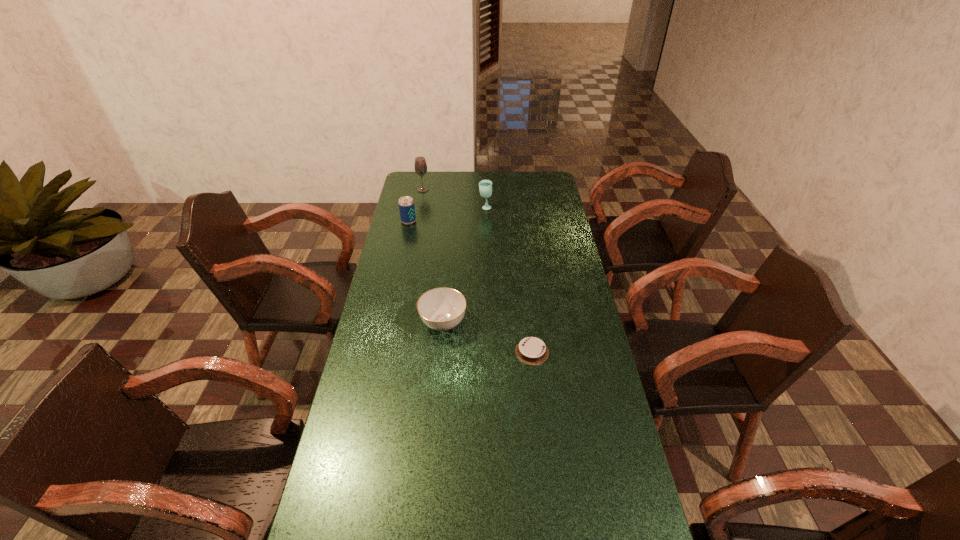
The height and width of the screenshot is (540, 960). Identify the location of free space at the right edge of the desktop. (560, 235).

Identify the location of free location at the far left corner. (413, 190).

Image resolution: width=960 pixels, height=540 pixels. I want to click on free space at the far right corner, so click(552, 177).

You are a GUI agent. You are given a task and a screenshot of the screen. Output one action in this format:
    pyautogui.click(x=<x>, y=<y>)
    Task: Click on the empty space between the chocolate cake and the third farthest object
    The width and height of the screenshot is (960, 540).
    Given the screenshot: What is the action you would take?
    pyautogui.click(x=470, y=287)

The width and height of the screenshot is (960, 540). Find the location of `vacant space in between the second shortest object and the right glass`. vacant space in between the second shortest object and the right glass is located at coordinates (465, 265).

Identify the location of vacant region between the chinaware and the beer can. pos(426,272).

Find the location of a particular element. The height and width of the screenshot is (540, 960). vacant region between the farthest object and the chinaware is located at coordinates (433, 256).

The width and height of the screenshot is (960, 540). What are the coordinates of `free spot between the shorter glass and the beer can` in the screenshot? It's located at (446, 214).

What are the coordinates of `empty space between the third farthest object and the chocolate cake` in the screenshot? It's located at (470, 287).

The image size is (960, 540). Identify the location of unoccupied area between the farther glass and the rightmost object. (477, 271).